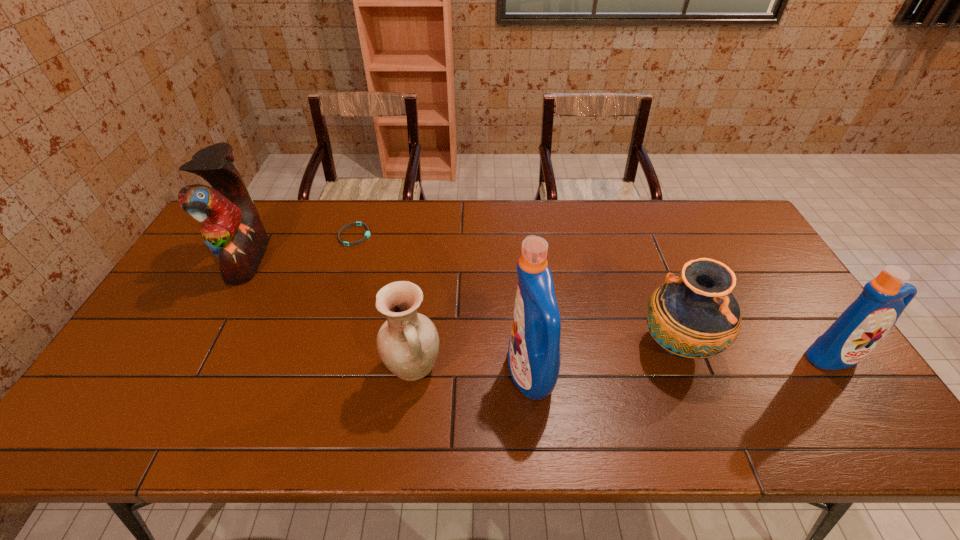
Where is `the left detergent`? the left detergent is located at coordinates (534, 357).

What are the coordinates of `the taller detergent` in the screenshot? It's located at (534, 357).

What are the coordinates of `the rightmost object` in the screenshot? It's located at (862, 326).

The image size is (960, 540). Identify the location of the shorter detergent. (862, 326).

In order to click on the leftmost object in this screenshot , I will do pos(231,227).

The image size is (960, 540). I want to click on the fifth object from right to left, so click(x=367, y=234).

Find the location of `the shortest object`. the shortest object is located at coordinates (367, 234).

In order to click on the left pottery in this screenshot , I will do `click(407, 343)`.

Identify the location of the second object from right to left. (695, 316).

Find the location of a particular element. free spot located 0.130m on the label of the fourth object from left to right is located at coordinates (456, 374).